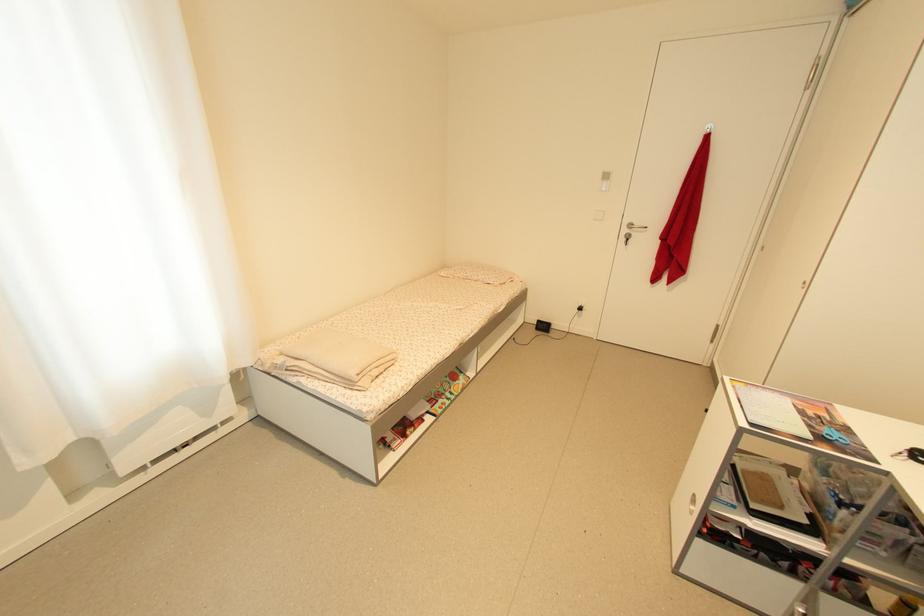
This screenshot has height=616, width=924. What do you see at coordinates (604, 180) in the screenshot?
I see `the white light switch` at bounding box center [604, 180].